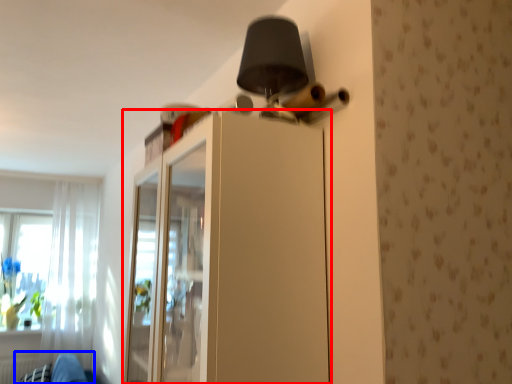
Question: Among these objects, which one is farthest to the camera, dresser (highlighted by a red box) or swivel chair (highlighted by a blue box)?

Choices:
 (A) dresser
 (B) swivel chair

Answer: (B)